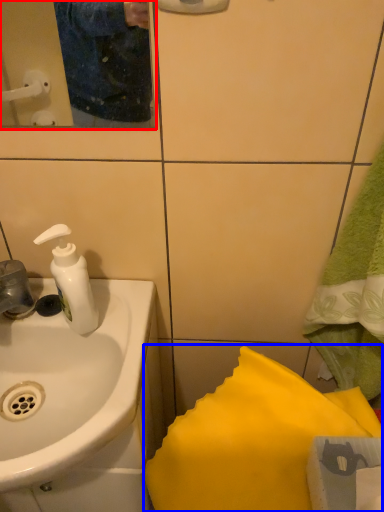
Question: Which of the following is the farthest to the observer, mirror (highlighted by a red box) or bath towel (highlighted by a blue box)?

Choices:
 (A) mirror
 (B) bath towel

Answer: (B)